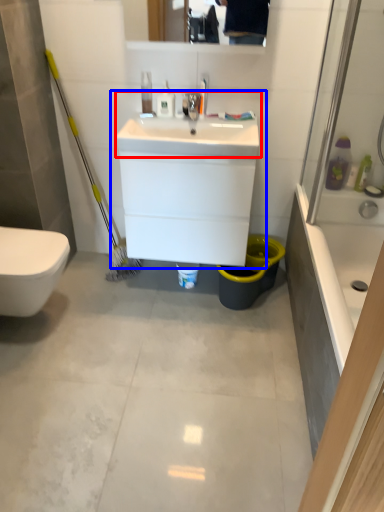
Question: Which object appears closest to the camera in this image, sink (highlighted by a red box) or sink (highlighted by a blue box)?

Choices:
 (A) sink
 (B) sink

Answer: (A)